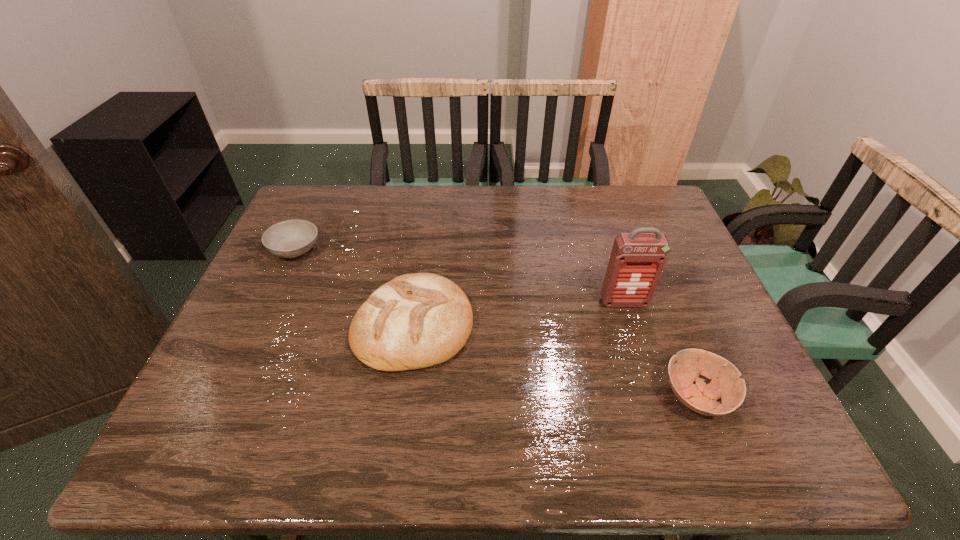
The width and height of the screenshot is (960, 540). Find the location of `the tallest object`. the tallest object is located at coordinates (637, 260).

Find the location of a particular element. This screenshot has width=960, height=540. the third object from right to left is located at coordinates (414, 321).

Identify the location of bread. (414, 321).

Find the location of `the right bowl`. the right bowl is located at coordinates (726, 384).

At what (x,y) coordinates should I click in order to perform the action: click on the shorter bowl. Please return your answer as a coordinate pair (x, y). The height and width of the screenshot is (540, 960). Looking at the image, I should click on (293, 238).

Identify the location of the shortest object. The width and height of the screenshot is (960, 540). (293, 238).

Where is `vacant space located on the front-facing side of the tallest object`? Image resolution: width=960 pixels, height=540 pixels. vacant space located on the front-facing side of the tallest object is located at coordinates coord(633,329).

Where is `vacant space located 0.200m on the right of the third object from right to left`? The width and height of the screenshot is (960, 540). vacant space located 0.200m on the right of the third object from right to left is located at coordinates (554, 324).

Find the location of `vacant region located 0.280m on the back of the nearer bowl`. vacant region located 0.280m on the back of the nearer bowl is located at coordinates (650, 280).

Locate an element on the screen. vacant region located on the right of the farthest object is located at coordinates (430, 250).